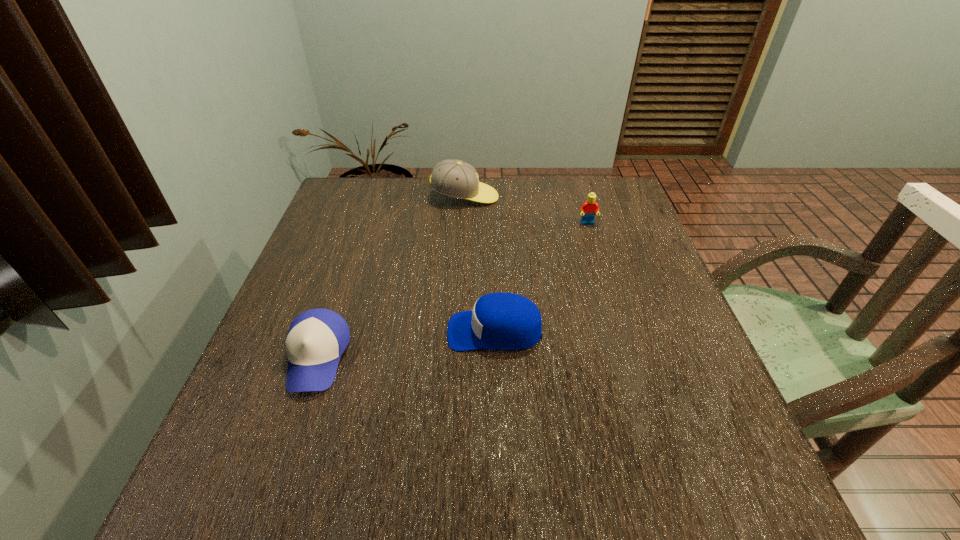
Locate which baseball cap ranks second in proximity to the rightmost object. Please provide its 2D coordinates. Your answer should be formatted as a tuple, i.e. [(x, y)], where the tuple contains the x and y coordinates of a point satisfying the conditions above.

[(499, 321)]

Where is `vacant area in the image that satisfies the following two spatial constraints: 1. on the front-facing side of the farthest baseball cap; 2. on the front-facing side of the leftmost object`? The height and width of the screenshot is (540, 960). vacant area in the image that satisfies the following two spatial constraints: 1. on the front-facing side of the farthest baseball cap; 2. on the front-facing side of the leftmost object is located at coordinates (457, 357).